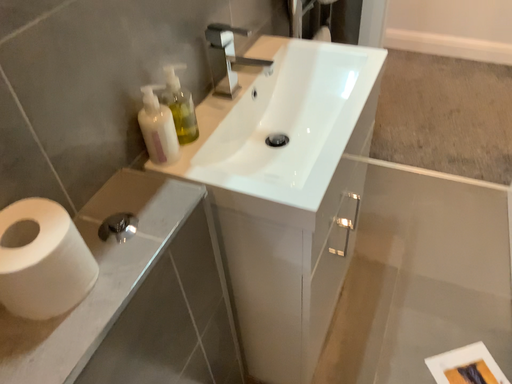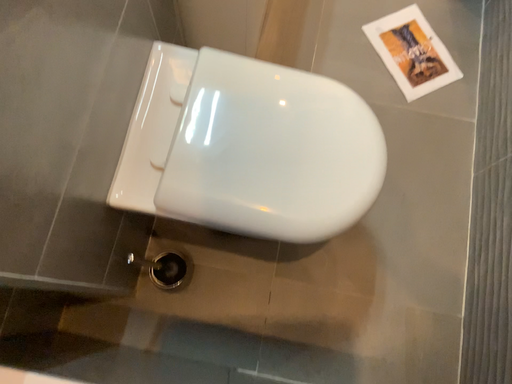
Question: How did the camera likely rotate when shooting the video?

Choices:
 (A) rotated right
 (B) rotated left

Answer: (A)